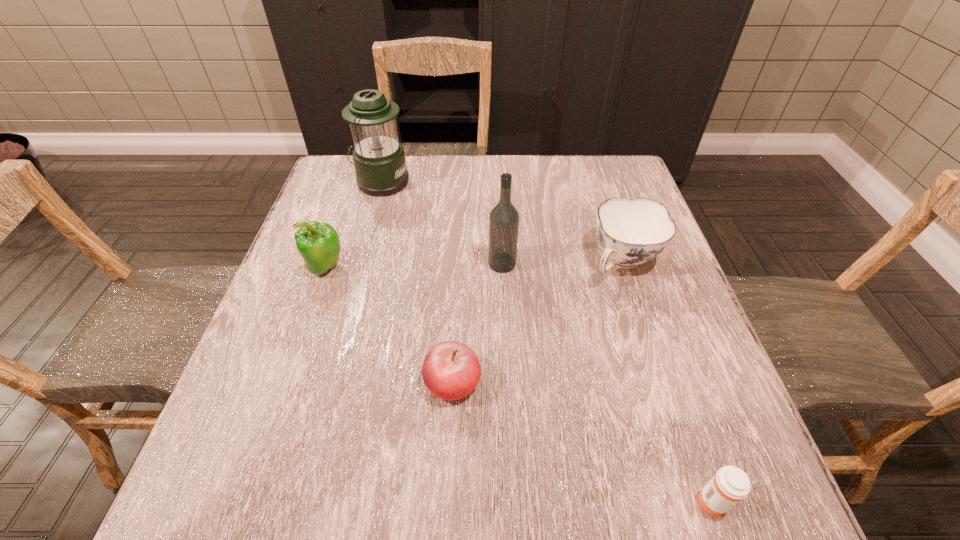
What are the coordinates of `vacant space located on the left of the chinaware` in the screenshot? It's located at (477, 262).

Find the location of a particular element. Image resolution: width=960 pixels, height=540 pixels. free space located on the right of the fourth object from right to left is located at coordinates (631, 382).

This screenshot has width=960, height=540. I want to click on free point located on the left of the nearest object, so click(x=516, y=500).

In order to click on object that is at the far edge in this screenshot , I will do `click(379, 160)`.

In order to click on object that is at the near edge in this screenshot , I will do `click(730, 484)`.

This screenshot has width=960, height=540. I want to click on lantern present at the left edge, so click(379, 160).

Where is `bell pepper situated at the left edge`? bell pepper situated at the left edge is located at coordinates (318, 243).

The image size is (960, 540). What are the coordinates of `chinaware that is at the right edge` in the screenshot? It's located at (631, 231).

Locate an element on the screen. medicine located at the right edge is located at coordinates (730, 484).

Where is `object that is at the far left corner`? This screenshot has height=540, width=960. object that is at the far left corner is located at coordinates (379, 160).